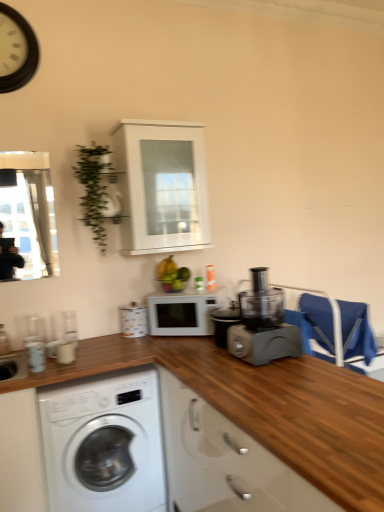
Image resolution: width=384 pixels, height=512 pixels. What are the coordinates of `white matte microwave at center` in the screenshot? It's located at (184, 312).

Where is `white wooden clock at upper left`? white wooden clock at upper left is located at coordinates [16, 50].

This screenshot has height=512, width=384. What do you see at coordinates (16, 50) in the screenshot?
I see `white wooden clock at upper left` at bounding box center [16, 50].

At what (x,y) coordinates should I click in order to perform the action: click on white glossy cabinet at upper center. Please return your answer as a coordinate pair (x, y). Looking at the image, I should click on (161, 186).

In order to click on clock that is above the wooden at lower center (from a real-world perspective) in this screenshot , I will do `click(16, 50)`.

Would you consider wooden at lower center to be distant from white wooden clock at upper left?

Indeed, wooden at lower center is not near white wooden clock at upper left.

From the picture: Which of these two, wooden at lower center or white wooden clock at upper left, is smaller?

Smaller between the two is white wooden clock at upper left.

Considering the sizes of objects wooden at lower center and white wooden clock at upper left in the image provided, who is thinner, wooden at lower center or white wooden clock at upper left?

Thinner between the two is white wooden clock at upper left.

From the image's perspective, relative to white glossy cup at lower left, positioned as the first appliance in left-to-right order, is wooden at lower center above or below?

wooden at lower center is below white glossy cup at lower left, positioned as the first appliance in left-to-right order.

Which object is wider, wooden at lower center or white glossy cup at lower left, the second appliance from the back?

Wider between the two is wooden at lower center.

The height and width of the screenshot is (512, 384). I want to click on appliance that is the 1st object above the wooden at lower center (from a real-world perspective), so click(x=62, y=350).

Could you tell me if wooden at lower center is facing white glossy canister at upper center, which ranks as the 1th appliance in back-to-front order?

No.

At what (x,y) coordinates should I click in order to perform the action: click on countertop that is under the white glossy canister at upper center, which is the 2th appliance in left-to-right order (from a real-world perspective). Please return your answer as a coordinate pair (x, y). This screenshot has width=384, height=512. Looking at the image, I should click on (266, 407).

Considering the points (110, 339) and (143, 328), which point is in front, point (110, 339) or point (143, 328)?

The point (110, 339) is closer to the camera.

Is wooden at lower center wider or thinner than white glossy canister at upper center, the 2th appliance when ordered from front to back?

Considering their sizes, wooden at lower center looks broader than white glossy canister at upper center, the 2th appliance when ordered from front to back.

Based on their sizes in the image, would you say wooden at lower center is bigger or smaller than green matte bananas at center?

Considering their sizes, wooden at lower center takes up more space than green matte bananas at center.

Are wooden at lower center and green matte bananas at center beside each other?

They are not placed beside each other.

How distant is wooden at lower center from green matte bananas at center?

wooden at lower center and green matte bananas at center are 3.53 feet apart.

Which object is positioned more to the left, wooden at lower center or green matte bananas at center?

green matte bananas at center is more to the left.

Would you say white glossy cabinet at upper center is to the left or to the right of white glossy washing machine at lower left in the picture?

In the image, white glossy cabinet at upper center appears on the right side of white glossy washing machine at lower left.

Consider the image. How different are the orientations of white glossy cabinet at upper center and white glossy washing machine at lower left in degrees?

The angle between the facing direction of white glossy cabinet at upper center and the facing direction of white glossy washing machine at lower left is 0.325 degrees.

Between white glossy cabinet at upper center and white glossy washing machine at lower left, which one has larger width?

With larger width is white glossy washing machine at lower left.

Is point (343, 311) in front of point (130, 411)?

No.

From a real-world perspective, which object stands above the other?

blue fabric chair at right is physically above.

How many degrees apart are the facing directions of blue fabric chair at right and white glossy washing machine at lower left?

They differ by 87.3 degrees in their facing directions.

Which of these two, blue fabric chair at right or white glossy washing machine at lower left, stands shorter?

blue fabric chair at right is shorter.

From a real-world perspective, which object rests below the other?

wooden at lower center is physically lower.

Looking at their sizes, would you say white wooden clock at upper left is wider or thinner than wooden at lower center?

Considering their sizes, white wooden clock at upper left looks slimmer than wooden at lower center.

Based on their sizes in the image, would you say white wooden clock at upper left is bigger or smaller than wooden at lower center?

Considering their sizes, white wooden clock at upper left takes up less space than wooden at lower center.

Is white wooden clock at upper left aimed at wooden at lower center?

No.

Identify the location of countertop below the white wooden clock at upper left (from the image's perspective). The width and height of the screenshot is (384, 512). (266, 407).

What are the coordinates of `the 2nd appliance counting from the left side of the wooden at lower center` in the screenshot? It's located at (62, 350).

Estimate the real-world distances between objects in this image. Which object is further from white glossy canister at upper center, the 2th appliance when ordered from front to back, wooden at lower center or blue fabric chair at right?

The object further to white glossy canister at upper center, the 2th appliance when ordered from front to back, is blue fabric chair at right.

Which object lies further to the anchor point matte plastic food processor at center-right, blue fabric chair at right or white glossy cabinet at upper center?

The object further to matte plastic food processor at center-right is white glossy cabinet at upper center.

From the image, which object appears to be farther from matte plastic food processor at center-right, wooden at lower center or white glossy washing machine at lower left?

Among the two, white glossy washing machine at lower left is located further to matte plastic food processor at center-right.

From the picture: Considering their positions, is white glossy washing machine at lower left positioned further to wooden at lower center than blue fabric chair at right?

The object further to wooden at lower center is blue fabric chair at right.

When comparing their distances from white matte microwave at center, does white wooden clock at upper left or wooden at lower center seem further?

white wooden clock at upper left.

Estimate the real-world distances between objects in this image. Which object is closer to white glossy washing machine at lower left, white wooden clock at upper left or blue fabric chair at right?

blue fabric chair at right is positioned closer to the anchor white glossy washing machine at lower left.

From the image, which object appears to be nearer to matte plastic food processor at center-right, blue fabric chair at right or green leafy plant at upper left?

blue fabric chair at right is closer to matte plastic food processor at center-right.

From the image, which object appears to be farther from white matte microwave at center, wooden at lower center or green leafy plant at upper left?

green leafy plant at upper left is positioned further to the anchor white matte microwave at center.

You are a GUI agent. You are given a task and a screenshot of the screen. Output one action in this format:
    pyautogui.click(x=<x>, y=<y>)
    Task: Click on the home appliance between white glossy cabinet at upper center and white glossy washing machine at lower left in the vertical direction
    
    Given the screenshot: What is the action you would take?
    pyautogui.click(x=263, y=324)

This screenshot has width=384, height=512. I want to click on microwave oven between white glossy cabinet at upper center and white glossy canister at upper center, which is the 2th appliance in left-to-right order, vertically, so click(184, 312).

Find the location of a particular element. This screenshot has width=384, height=512. cabinetry located between wooden at lower center and blue fabric chair at right in the depth direction is located at coordinates (161, 186).

Locate an element on the screen. The width and height of the screenshot is (384, 512). home appliance between white wooden clock at upper left and blue fabric chair at right in the horizontal direction is located at coordinates (263, 324).